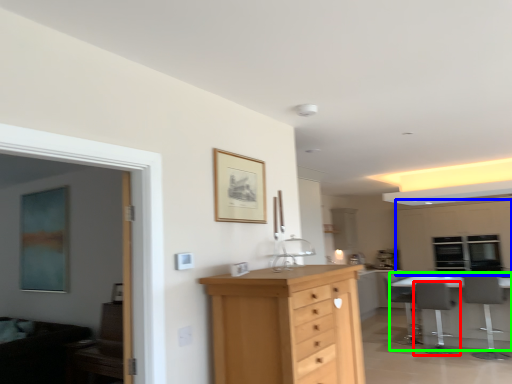
Question: Estimate the real-world distances between objects in this image. Which object is closer to chair (highlighted by a red box), cabinetry (highlighted by a blue box) or table (highlighted by a green box)?

Choices:
 (A) cabinetry
 (B) table

Answer: (B)